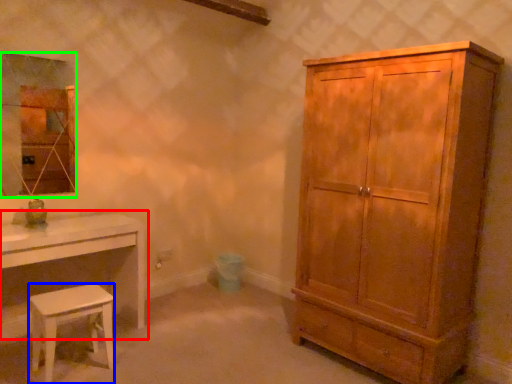
Question: Which object is positioned farthest from table (highlighted by a red box)? Select from stool (highlighted by a blue box) and mirror (highlighted by a green box).

Choices:
 (A) stool
 (B) mirror

Answer: (B)